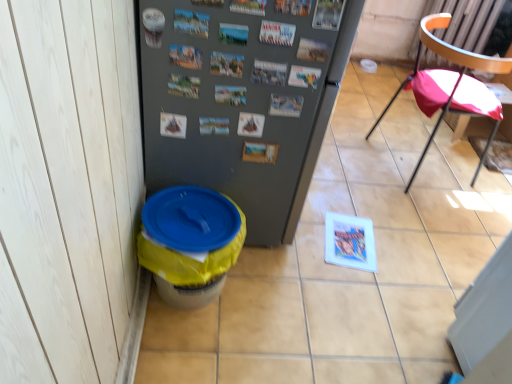
Identify the location of free area in between gray matte refrigerator at center and yellow plastic potty at lower left. (263, 280).